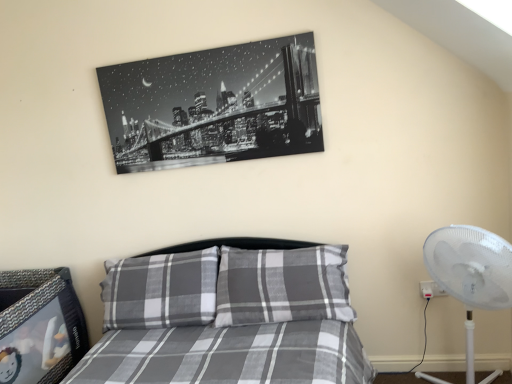
At what (x,y) coordinates should I click in order to perform the action: click on empty space that is ontop of black glossy print at upper center. Please return your answer as a coordinate pair (x, y). Looking at the image, I should click on (205, 47).